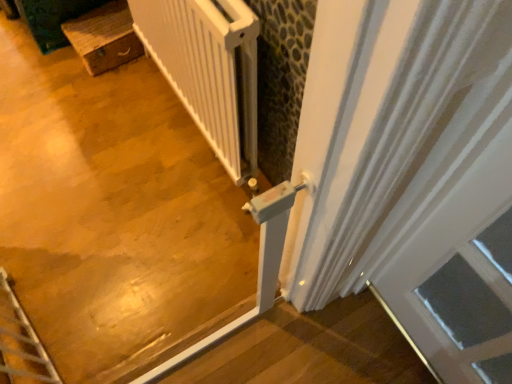
At what (x,y) coordinates should I click in order to perform the action: click on vacant space situated on the left part of white matte radiator at center. Please return your answer as a coordinate pair (x, y). This screenshot has height=384, width=512. Looking at the image, I should click on (92, 126).